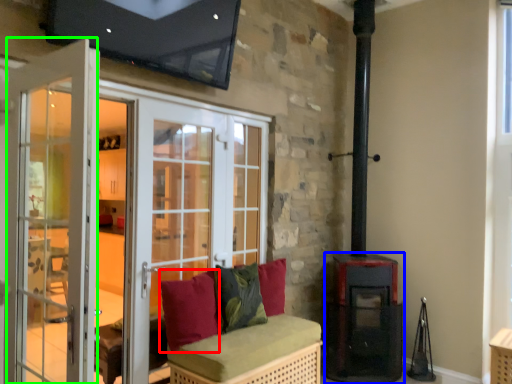
Question: Which is farther away from pillow (highlighted by a red box)? stove (highlighted by a blue box) or screen door (highlighted by a green box)?

Choices:
 (A) stove
 (B) screen door

Answer: (A)